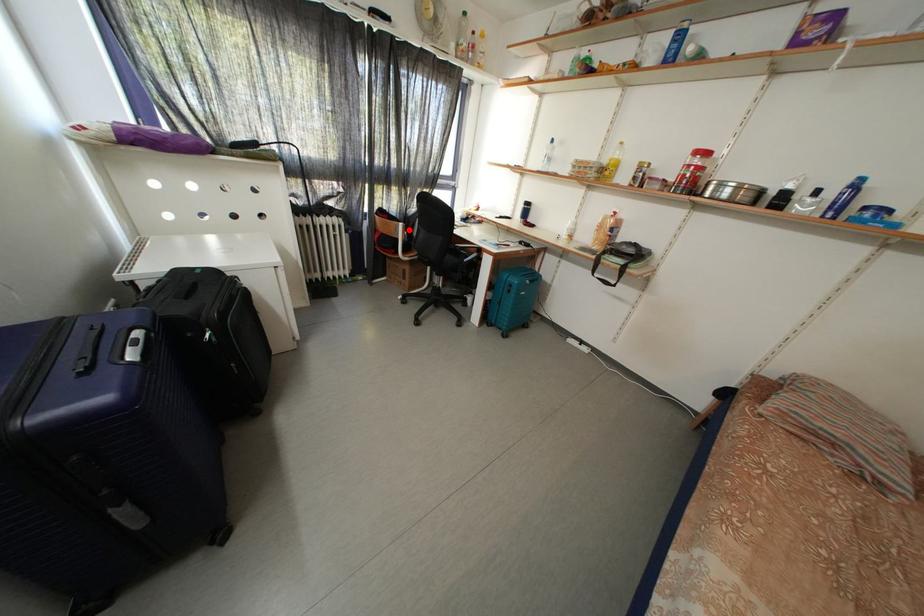
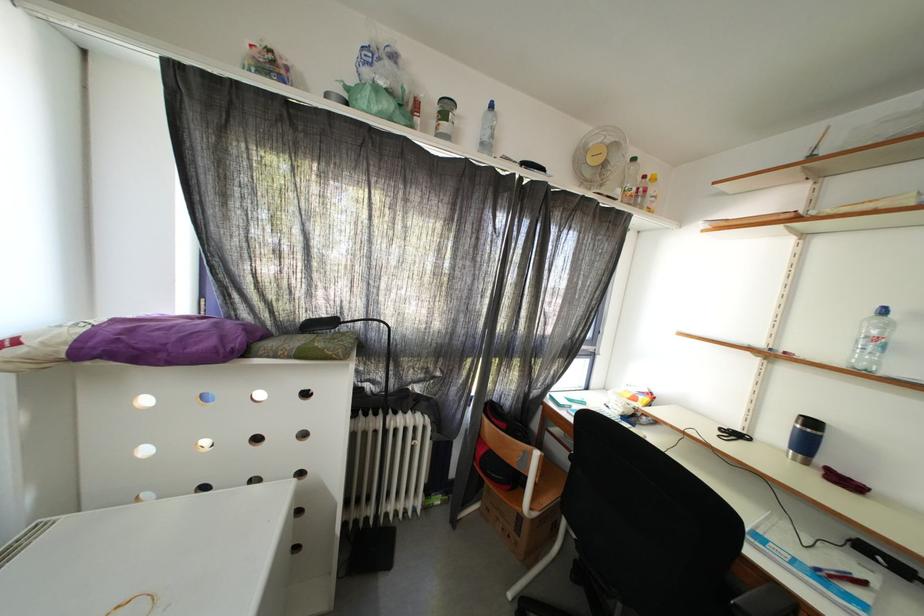
Question: I am providing you with two images of the same scene from different viewpoints. Given a red point in image1, look at the same physical point in image2. Is it:

Choices:
 (A) Closer to the viewpoint
 (B) Farther from the viewpoint

Answer: (A)